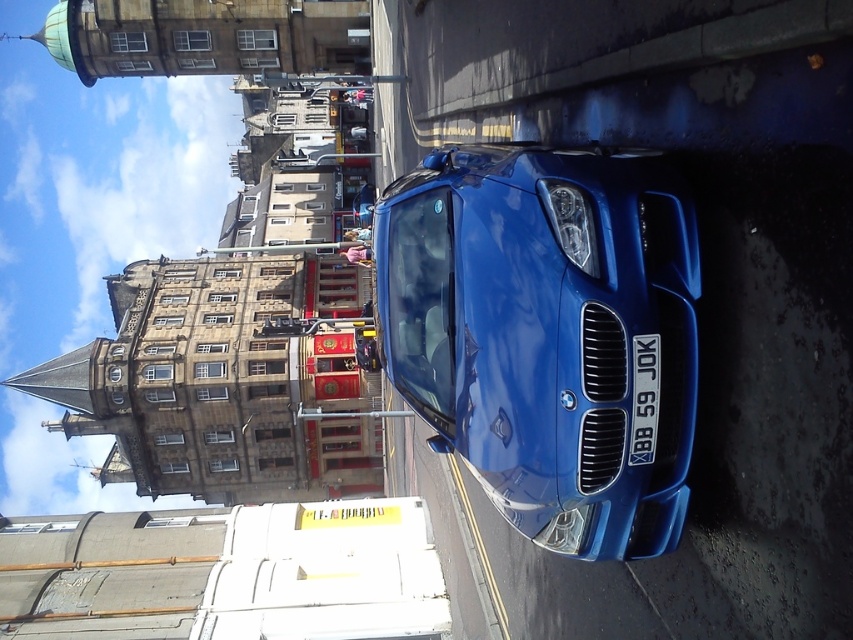
Question: Does shiny blue car at center appear over white plastic license plate at center?

Choices:
 (A) no
 (B) yes

Answer: (B)

Question: Which point is farther to the camera?

Choices:
 (A) shiny blue car at center
 (B) white plastic license plate at center

Answer: (B)

Question: Considering the relative positions of shiny blue car at center and white plastic license plate at center in the image provided, where is shiny blue car at center located with respect to white plastic license plate at center?

Choices:
 (A) below
 (B) above

Answer: (B)

Question: Which point appears closest to the camera in this image?

Choices:
 (A) (631, 364)
 (B) (575, 483)

Answer: (A)

Question: Can you confirm if shiny blue car at center is wider than white plastic license plate at center?

Choices:
 (A) yes
 (B) no

Answer: (A)